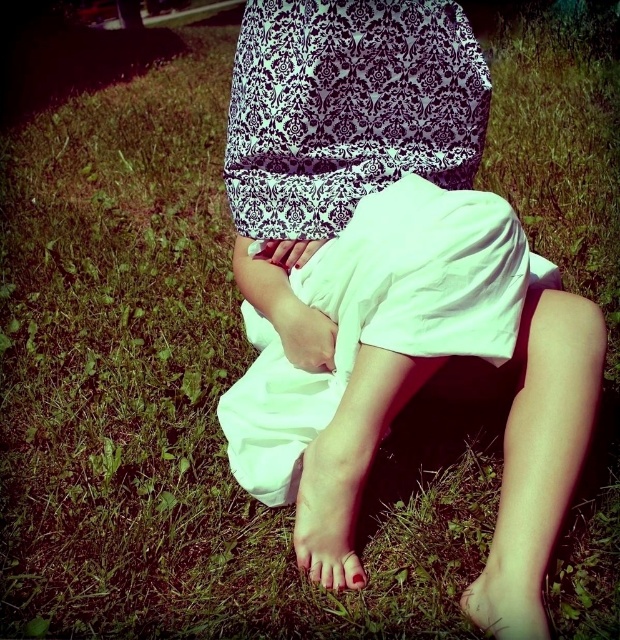
In the scene shown: You are a photographer trying to capture the white cotton shorts at center in the image. Based on the coordinates given, where should you focus your camera to ensure the shorts are in the center of the photo?

The white cotton shorts at center are located at coordinates point (339, 132), so you should focus your camera there to center them in the photo.

You are a photographer setting up a shot of the person in the scene. You want to ensure the white cotton shorts at center and the nude skin foot at lower center are both visible. Based on their positions, which object should you focus on first to capture both in the frame?

The white cotton shorts at center is to the left of nude skin foot at lower center, so focusing on the white cotton shorts at center first would allow you to frame both objects since they are positioned side by side horizontally.

You are a photographer setting up for a shoot. You need to ensure that the white cotton shorts at center and the nude skin foot at lower center are both visible in the frame. Based on their positions, which object should you focus on first to ensure both are in focus?

Since the white cotton shorts at center has a greater height compared to the nude skin foot at lower center, you should focus on the white cotton shorts at center first to ensure both are in focus.